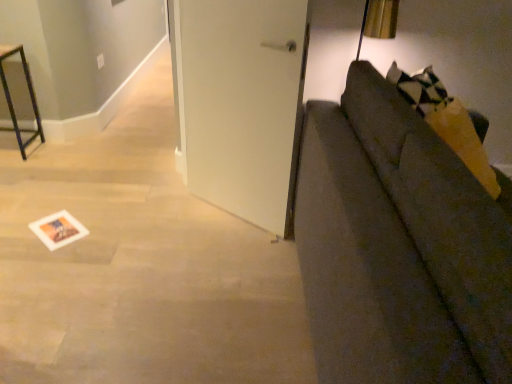
Question: Is white matte door at center outside metal frame at left?

Choices:
 (A) yes
 (B) no

Answer: (A)

Question: Can you confirm if white matte door at center is wider than metal frame at left?

Choices:
 (A) no
 (B) yes

Answer: (A)

Question: Is metal frame at left completely or partially inside white matte door at center?

Choices:
 (A) yes
 (B) no

Answer: (B)

Question: Is white matte door at center at the right side of metal frame at left?

Choices:
 (A) no
 (B) yes

Answer: (B)

Question: From a real-world perspective, does white matte door at center sit lower than metal frame at left?

Choices:
 (A) no
 (B) yes

Answer: (A)

Question: Would you say white paper postcard at lower left is to the left or to the right of metal frame at left in the picture?

Choices:
 (A) left
 (B) right

Answer: (B)

Question: Is white paper postcard at lower left wider or thinner than metal frame at left?

Choices:
 (A) wide
 (B) thin

Answer: (B)

Question: From their relative heights in the image, would you say white paper postcard at lower left is taller or shorter than metal frame at left?

Choices:
 (A) tall
 (B) short

Answer: (B)

Question: Is white paper postcard at lower left bigger or smaller than metal frame at left?

Choices:
 (A) big
 (B) small

Answer: (B)

Question: Does point (10, 99) appear closer or farther from the camera than point (448, 235)?

Choices:
 (A) closer
 (B) farther

Answer: (B)

Question: Based on their positions, is metal frame at left located to the left or right of textured gray couch at right?

Choices:
 (A) left
 (B) right

Answer: (A)

Question: From the image's perspective, is metal frame at left positioned above or below textured gray couch at right?

Choices:
 (A) below
 (B) above

Answer: (B)

Question: From their relative heights in the image, would you say metal frame at left is taller or shorter than textured gray couch at right?

Choices:
 (A) tall
 (B) short

Answer: (B)

Question: Considering the positions of metal frame at left and white paper postcard at lower left in the image, is metal frame at left wider or thinner than white paper postcard at lower left?

Choices:
 (A) thin
 (B) wide

Answer: (B)

Question: From a real-world perspective, is metal frame at left physically located above or below white paper postcard at lower left?

Choices:
 (A) above
 (B) below

Answer: (A)